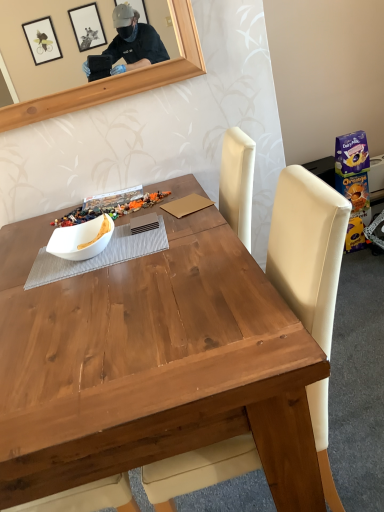
Question: From their relative heights in the image, would you say wooden chair at center is taller or shorter than white matte bowl at center?

Choices:
 (A) tall
 (B) short

Answer: (A)

Question: In terms of size, does wooden chair at center appear bigger or smaller than white matte bowl at center?

Choices:
 (A) small
 (B) big

Answer: (B)

Question: Which object is the farthest from the wooden chair at center?

Choices:
 (A) white matte bowl at center
 (B) white matte bowl at center

Answer: (A)

Question: Which object is positioned closest to the white matte bowl at center?

Choices:
 (A) wooden chair at center
 (B) white matte bowl at center

Answer: (B)